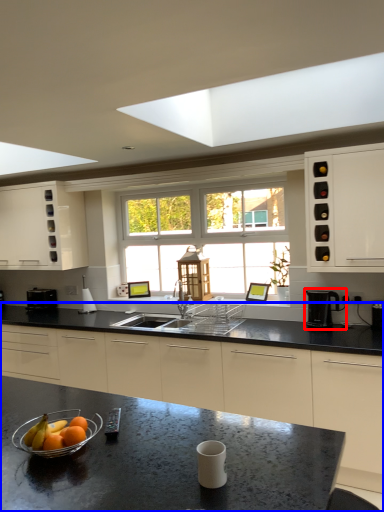
Question: Among these objects, which one is farthest to the camera, coffee machine (highlighted by a red box) or countertop (highlighted by a blue box)?

Choices:
 (A) coffee machine
 (B) countertop

Answer: (A)